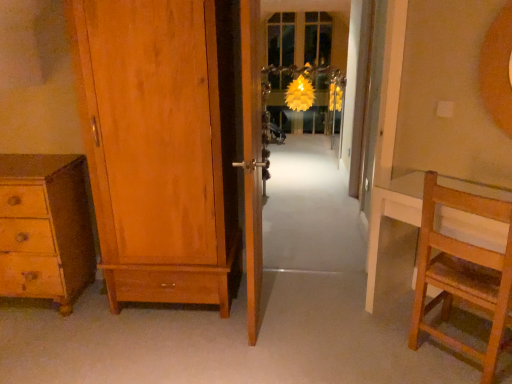
Find the location of a particular element. Image resolution: width=512 pixels, height=384 pixels. empty space that is in between light brown wooden chair at right and matte wood wardrobe at left, which is the first door in left-to-right order is located at coordinates (318, 330).